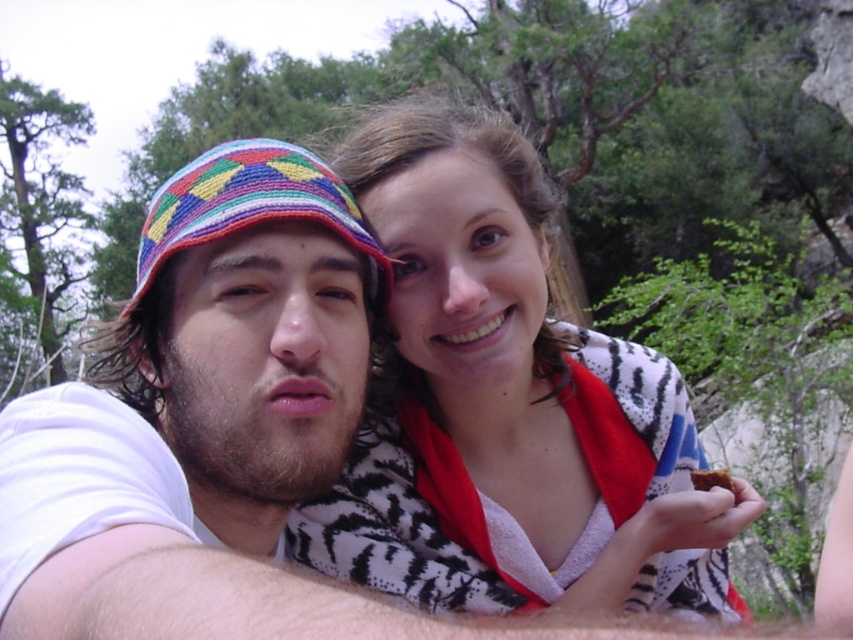
Question: Is zebra print scarf at center below brown crumbly bread at lower right?

Choices:
 (A) yes
 (B) no

Answer: (B)

Question: Among these objects, which one is nearest to the camera?

Choices:
 (A) brown crumbly bread at lower right
 (B) zebra print scarf at center

Answer: (B)

Question: Does beaded fabric hat at left have a greater width compared to brown crumbly bread at lower right?

Choices:
 (A) yes
 (B) no

Answer: (A)

Question: Which point is closer to the camera?

Choices:
 (A) zebra print scarf at center
 (B) beaded fabric hat at left
 (C) brown crumbly bread at lower right
 (D) multicolored woven hat at center

Answer: (D)

Question: Is zebra print scarf at center positioned behind brown crumbly bread at lower right?

Choices:
 (A) yes
 (B) no

Answer: (B)

Question: Which point is closer to the camera?

Choices:
 (A) (639, 474)
 (B) (712, 474)

Answer: (B)